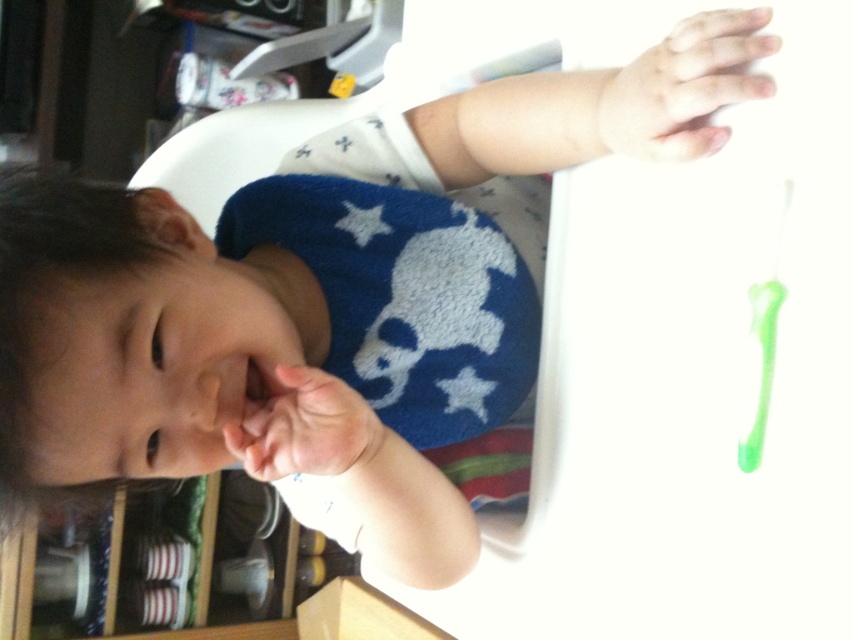
Question: Does smooth skin hand at upper right appear on the right side of pink soft skin at center?

Choices:
 (A) no
 (B) yes

Answer: (B)

Question: Does smooth skin hand at upper right come behind pink soft skin at center?

Choices:
 (A) no
 (B) yes

Answer: (A)

Question: Is smooth skin hand at upper right positioned before pink soft skin at center?

Choices:
 (A) yes
 (B) no

Answer: (A)

Question: Which of the following is the closest to the observer?

Choices:
 (A) (659, 109)
 (B) (289, 472)

Answer: (A)